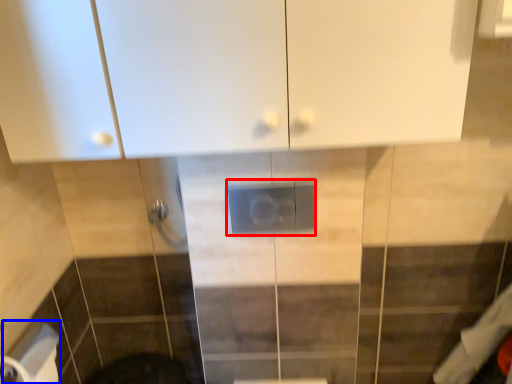
Question: Which object appears farthest to the camera in this image, electric outlet (highlighted by a red box) or toilet paper (highlighted by a blue box)?

Choices:
 (A) electric outlet
 (B) toilet paper

Answer: (A)